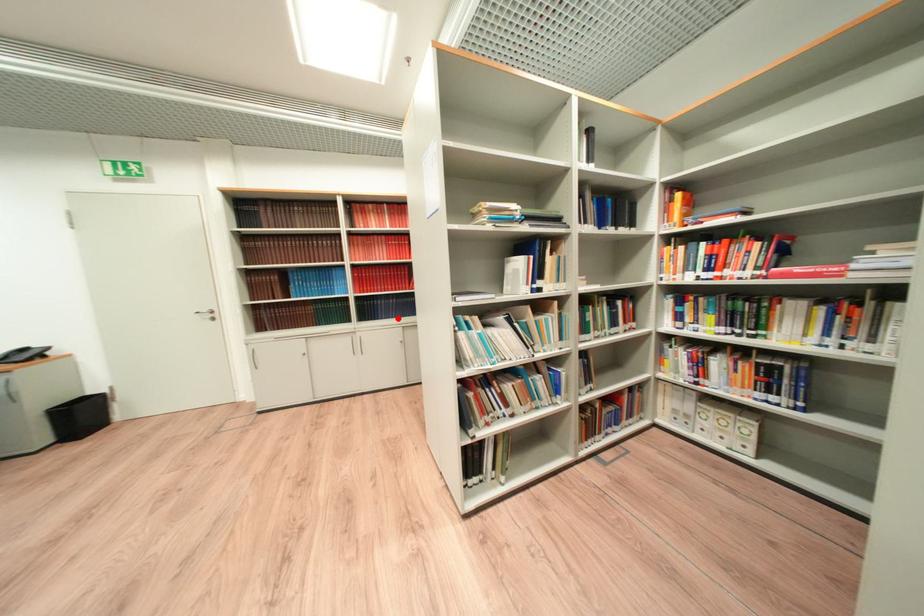
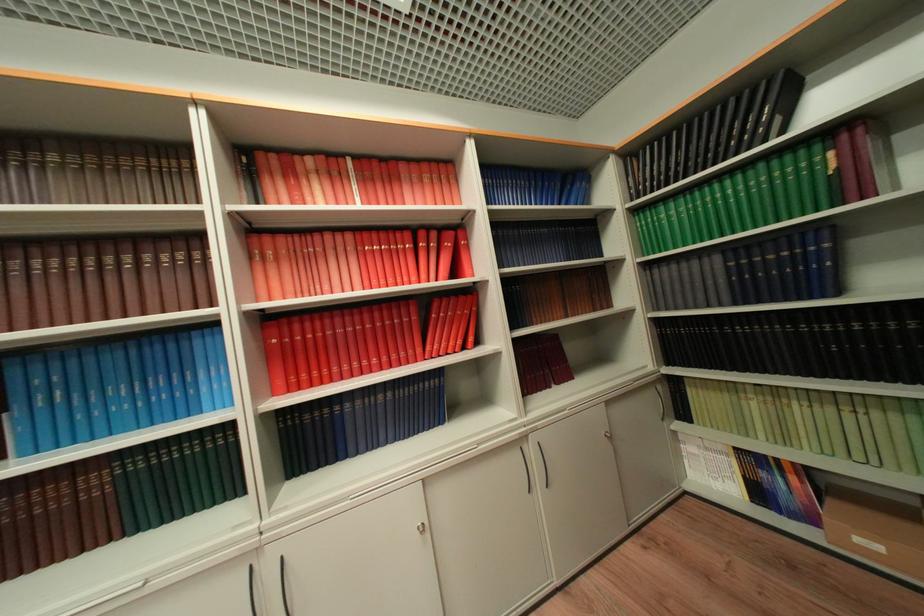
Find the pixel in the second image that matches the highlighted location in the first image.

(383, 446)